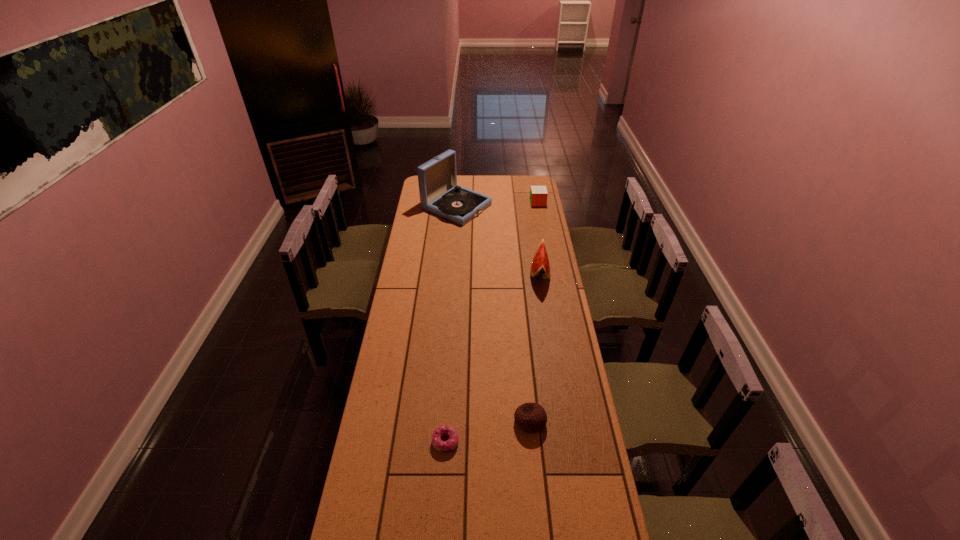
The image size is (960, 540). I want to click on free space located on the outer rind of the watermelon, so click(x=484, y=272).

This screenshot has width=960, height=540. Identify the location of vacant region located 0.070m on the back of the cube. (536, 193).

The height and width of the screenshot is (540, 960). I want to click on vacant space positioned on the left of the beanbag, so click(420, 421).

Locate an element on the screen. free location located on the right of the doughnut is located at coordinates (488, 441).

The height and width of the screenshot is (540, 960). I want to click on object positioned at the far edge, so click(439, 193).

Where is `object that is at the left edge`? object that is at the left edge is located at coordinates (439, 193).

In order to click on watermelon that is positioned at the right edge in this screenshot , I will do `click(540, 268)`.

At what (x,y) coordinates should I click in order to perform the action: click on cube that is at the right edge. Please return your answer as a coordinate pair (x, y). Looking at the image, I should click on (538, 194).

The width and height of the screenshot is (960, 540). Find the location of `beanbag located at the right edge`. beanbag located at the right edge is located at coordinates (530, 417).

Find the location of `object at the far left corner`. object at the far left corner is located at coordinates (439, 193).